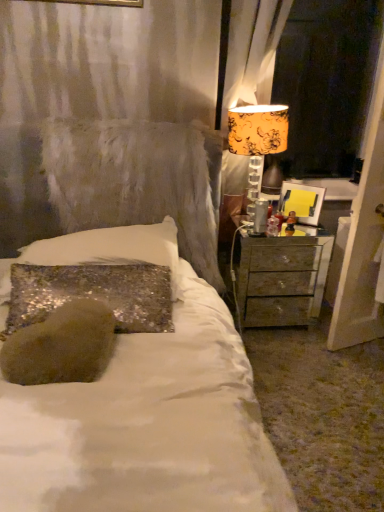
Question: From a real-world perspective, is sparkly silver pillow at center positioned above or below metallic silver nightstand at right?

Choices:
 (A) above
 (B) below

Answer: (A)

Question: Is sparkly silver pillow at center in front of or behind metallic silver nightstand at right in the image?

Choices:
 (A) behind
 (B) front

Answer: (B)

Question: Which of these objects is positioned closest to the sparkly silver pillow at center?

Choices:
 (A) orange floral fabric lampshade at upper right
 (B) orange floral fabric at right
 (C) metallic silver nightstand at right
 (D) yellow paper at right

Answer: (A)

Question: Which of these objects is positioned farthest from the yellow paper at right?

Choices:
 (A) metallic silver nightstand at right
 (B) orange floral fabric at right
 (C) sparkly silver pillow at center
 (D) orange floral fabric lampshade at upper right

Answer: (B)